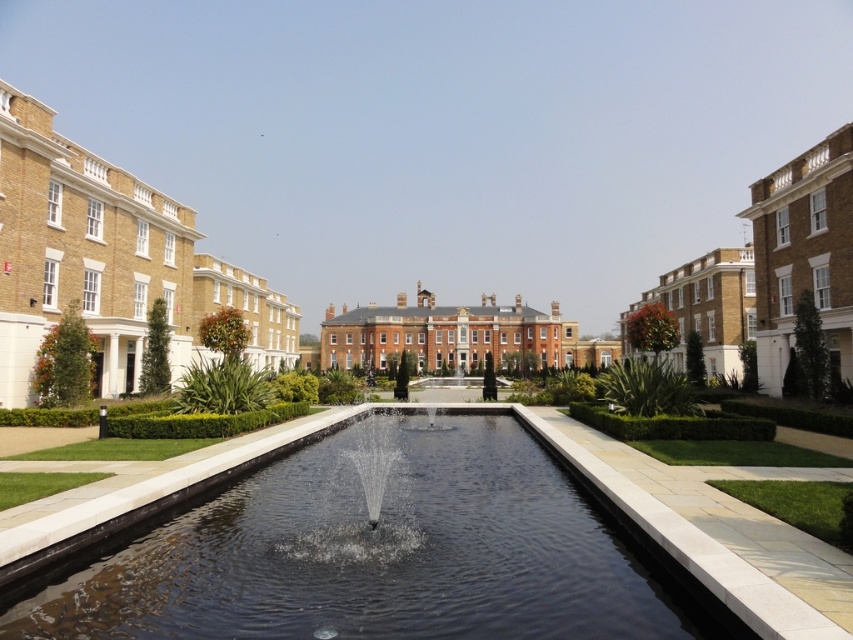
Does beige brick building at left appear on the right side of brick building at center?

No, beige brick building at left is not to the right of brick building at center.

Does beige brick building at left have a greater height compared to brick building at center?

Indeed, beige brick building at left has a greater height compared to brick building at center.

The width and height of the screenshot is (853, 640). I want to click on beige brick building at left, so click(x=108, y=262).

Locate an element on the screen. This screenshot has height=640, width=853. beige brick building at left is located at coordinates (108, 262).

Does clear glass fountain at center lie behind matte brick building at right?

No, clear glass fountain at center is in front of matte brick building at right.

Which of these two, clear glass fountain at center or matte brick building at right, stands taller?

Standing taller between the two is matte brick building at right.

Between point (317, 528) and point (624, 353), which one is positioned behind?

The point (624, 353) is more distant.

Where is `clear glass fountain at center`? The width and height of the screenshot is (853, 640). clear glass fountain at center is located at coordinates (350, 497).

Can you confirm if clear glass pond at center is positioned to the right of brown brick building at right?

In fact, clear glass pond at center is to the left of brown brick building at right.

Where is `clear glass pond at center`? clear glass pond at center is located at coordinates (378, 552).

Which is in front, point (486, 508) or point (848, 211)?

Point (486, 508) is in front.

Image resolution: width=853 pixels, height=640 pixels. I want to click on clear glass pond at center, so click(x=378, y=552).